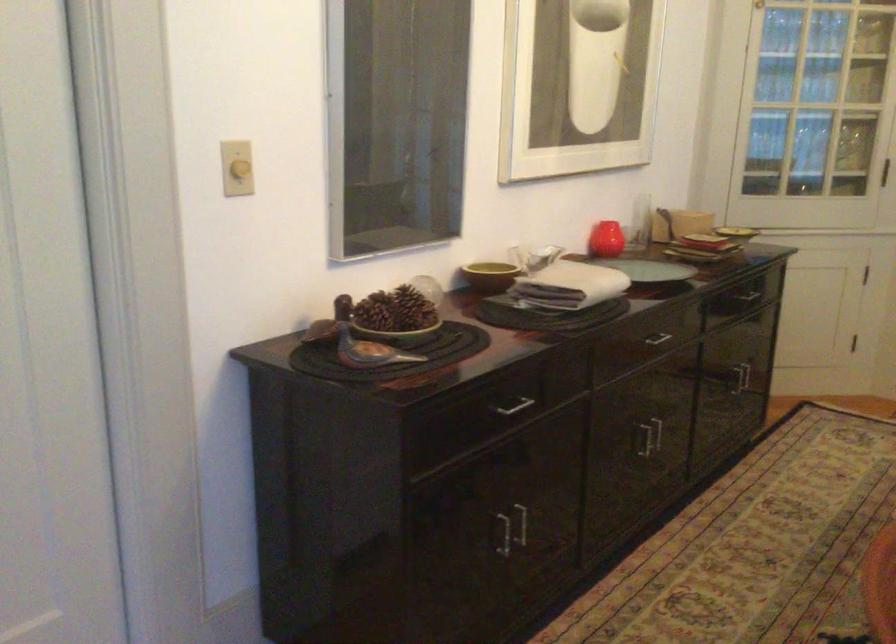
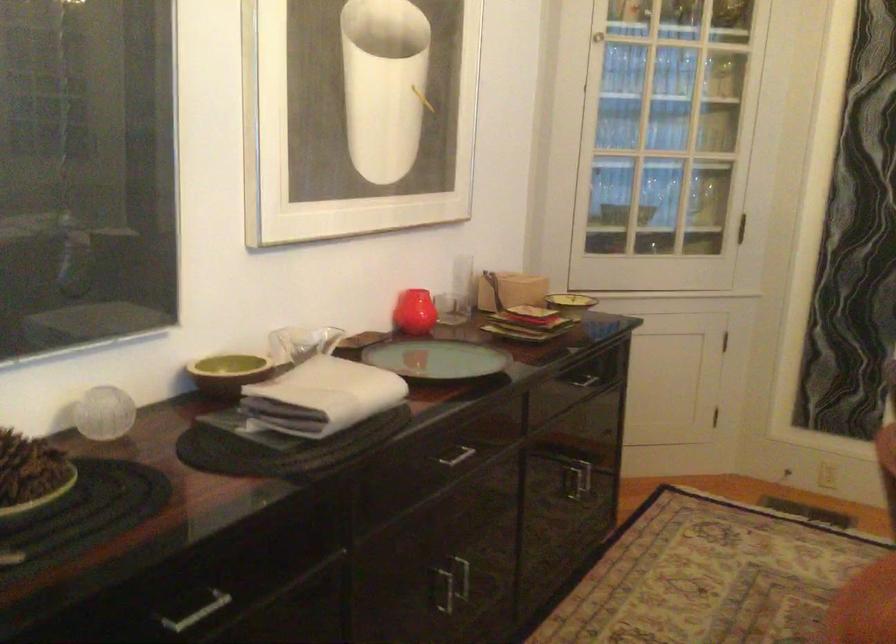
Find the pixel in the second image that matches (686,223) in the first image.

(510, 290)